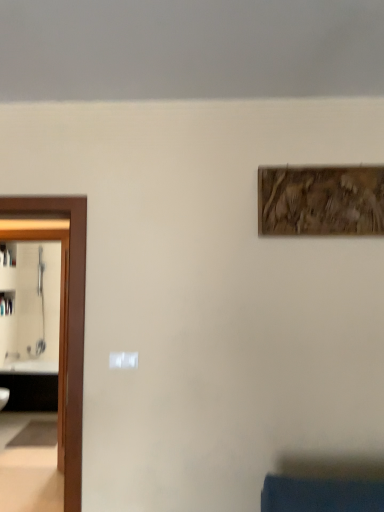
Question: Is wooden textured artwork at upper right wider or thinner than brown wooden door at left?

Choices:
 (A) thin
 (B) wide

Answer: (A)

Question: From the image's perspective, relative to brown wooden door at left, is wooden textured artwork at upper right above or below?

Choices:
 (A) below
 (B) above

Answer: (B)

Question: Considering the real-world distances, which object is farthest from the wooden textured artwork at upper right?

Choices:
 (A) brown wooden door at left
 (B) white glossy sink at left

Answer: (B)

Question: Estimate the real-world distances between objects in this image. Which object is closer to the white glossy sink at left?

Choices:
 (A) brown wooden door at left
 (B) wooden textured artwork at upper right

Answer: (A)